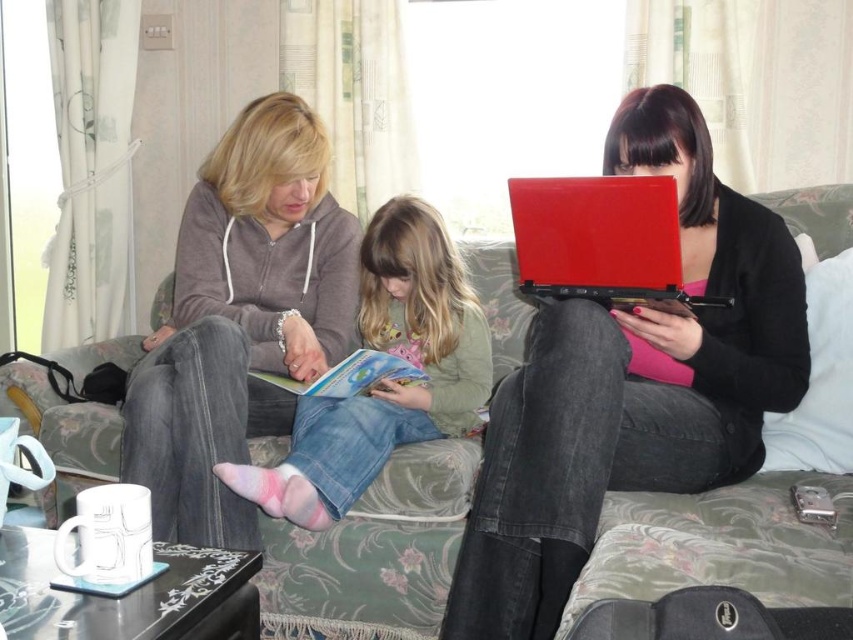
Question: Which point appears closest to the camera in this image?

Choices:
 (A) (682, 186)
 (B) (444, 403)

Answer: (A)

Question: Can you confirm if matte red laptop at center is wider than matte gray hoodie at center?

Choices:
 (A) yes
 (B) no

Answer: (A)

Question: Can you confirm if matte red laptop at center is smaller than denim jeans at center?

Choices:
 (A) no
 (B) yes

Answer: (A)

Question: Which point is farther to the camera?

Choices:
 (A) (407, 588)
 (B) (351, 365)
 (C) (370, 269)

Answer: (C)

Question: Is matte red laptop at center to the right of denim jeans at center from the viewer's perspective?

Choices:
 (A) no
 (B) yes

Answer: (B)

Question: Which object is the farthest from the denim jeans at center?

Choices:
 (A) matte red laptop at center
 (B) matte red laptop at center right
 (C) matte gray hoodie at center

Answer: (B)